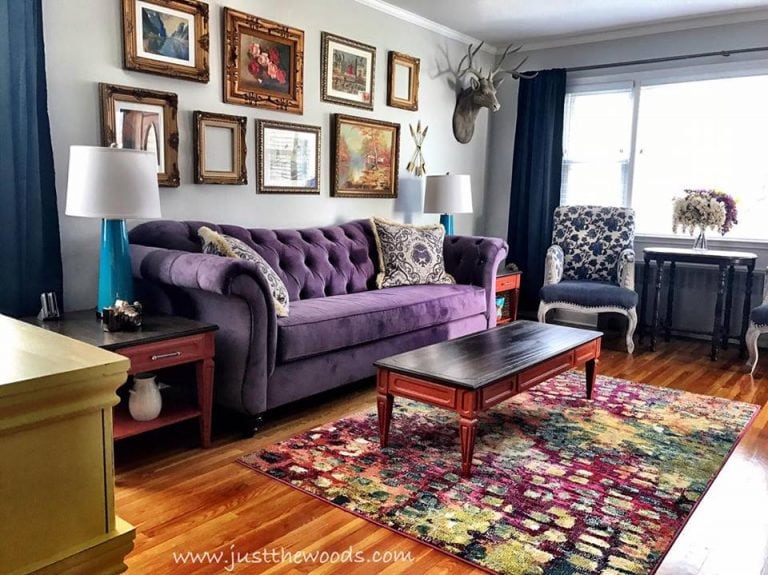
You are a GUI agent. You are given a task and a screenshot of the screen. Output one action in this format:
    pyautogui.click(x=<x>, y=<y>)
    Task: Click on the multicolored rectangular rug
    The height and width of the screenshot is (575, 768).
    Given the screenshot: What is the action you would take?
    pyautogui.click(x=600, y=512)